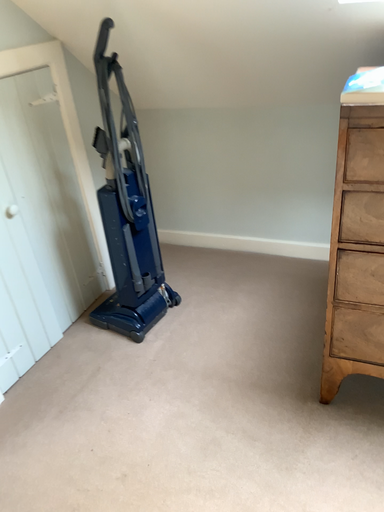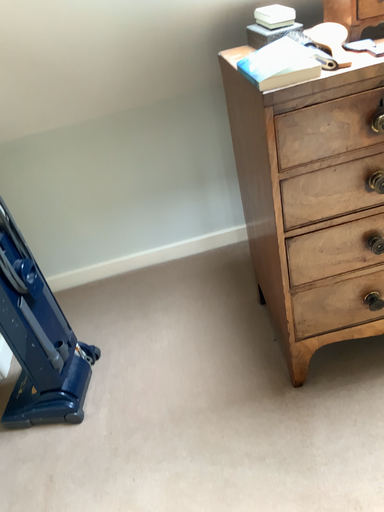
Question: Which way did the camera rotate in the video?

Choices:
 (A) rotated left
 (B) rotated right

Answer: (B)